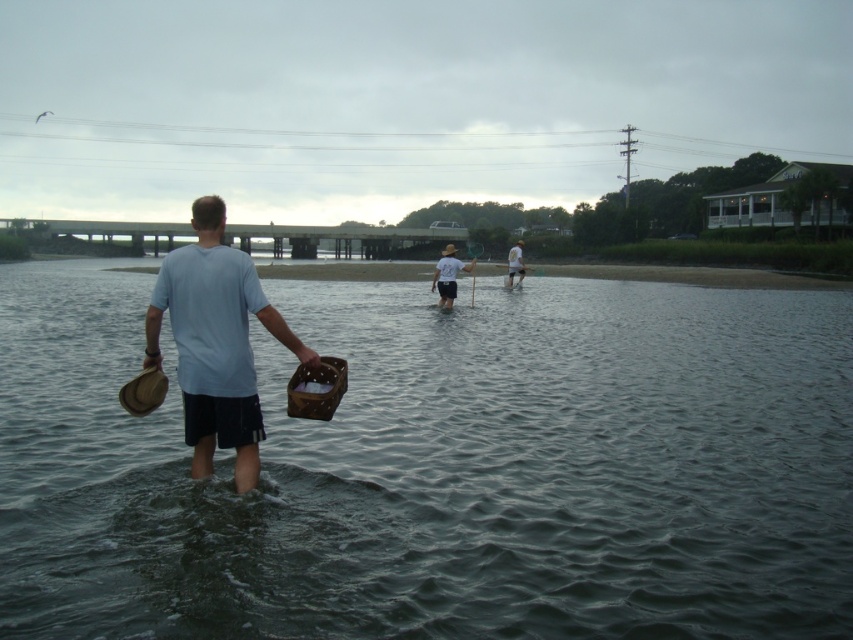
You are a fashion designer observing two shirts in the image. The light blue cotton shirt at center and the white cotton shirt at center. Which shirt is shorter in height?

The light blue cotton shirt at center has a lesser height compared to the white cotton shirt at center, so the light blue cotton shirt at center is shorter.

You are a photographer standing in front of the coastal scene. You want to take a photo focusing on the clear water at center and the light blue cotton shirt at center. Which object is closer to you so it will be in focus first?

The clear water at center is closer to the viewer than the light blue cotton shirt at center, so it will be in focus first.